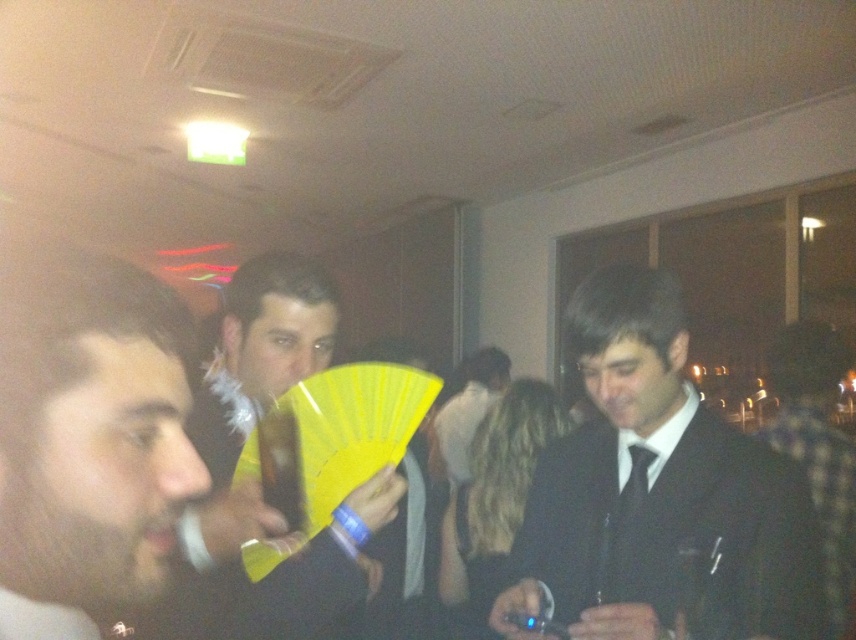
You are at a party and want to hand out a small gift to someone wearing the patterned fabric shirt at right. The gift is the size of the yellow paper fan at center. Will the gift fit in their shirt pocket?

The yellow paper fan at center is smaller than the patterned fabric shirt at right, so the gift will fit in the shirt pocket.

Consider the image. You are at a party and want to hand out a small gift to someone. You have a yellow paper fan at center and a white fur coat at center. Which object is more suitable for holding the gift?

The yellow paper fan at center is smaller than the white fur coat at center, so it is more suitable for holding the gift.

In the scene shown: You are a photographer at a party and notice two items at the right side of the scene. The items are the black satin suit at right and the patterned fabric shirt at right. Which one is covering the other?

The black satin suit at right is positioned over the patterned fabric shirt at right, so it is covering the shirt.